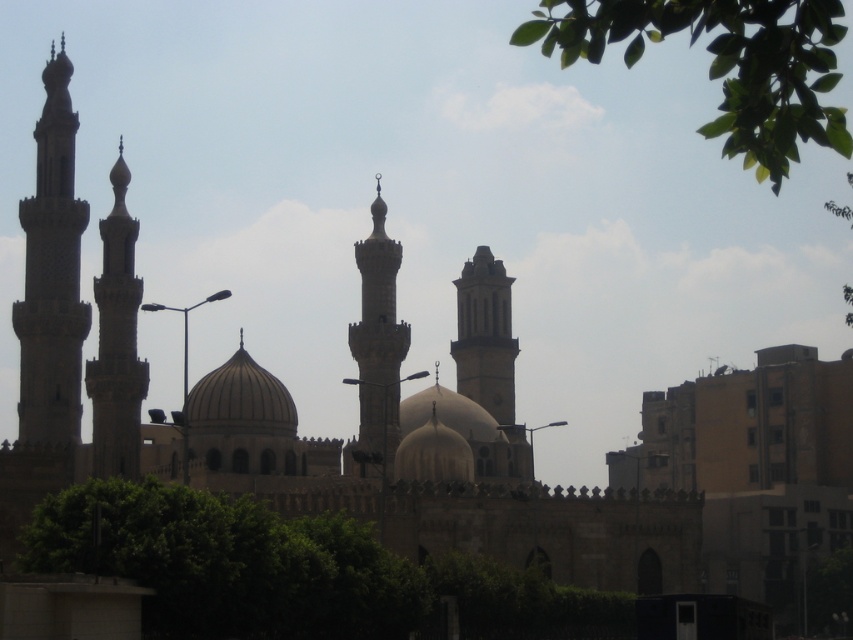
You are a drone operator tasked with capturing aerial footage of the mosque. You notice two minarets in the scene. Which minaret, the stone minaret at left or the smooth stone minaret at center, is taller and would require adjusting the drone altitude more to fully capture its height?

The stone minaret at left is taller than the smooth stone minaret at center, so adjusting the drone altitude more would be necessary to fully capture its height.

You are an architect analyzing the mosque structure. Based on the scene, which object occupies a more prominent spatial presence in the image, the stone minaret at left or the smooth beige dome at center?

The stone minaret at left has a larger size compared to the smooth beige dome at center, so it occupies a more prominent spatial presence.